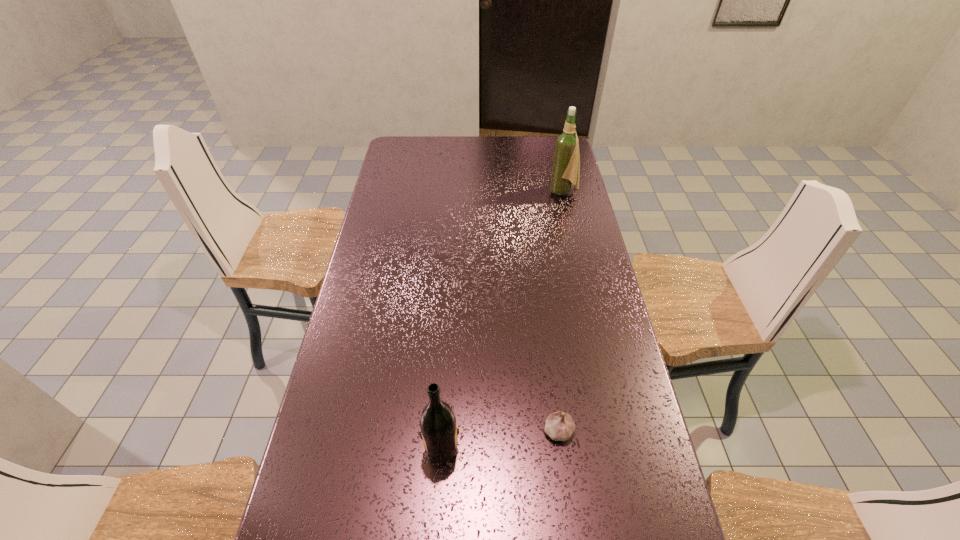
This screenshot has width=960, height=540. What are the coordinates of `the rightmost object` in the screenshot? It's located at (566, 165).

I want to click on the farther wine bottle, so click(566, 165).

At what (x,y) coordinates should I click in order to perform the action: click on the shorter wine bottle. Please return your answer as a coordinate pair (x, y). Looking at the image, I should click on (438, 426).

The width and height of the screenshot is (960, 540). I want to click on the second shortest object, so click(x=438, y=426).

Image resolution: width=960 pixels, height=540 pixels. I want to click on garlic, so click(x=559, y=426).

Where is `the shortest object`? Image resolution: width=960 pixels, height=540 pixels. the shortest object is located at coordinates (559, 426).

You are a GUI agent. You are given a task and a screenshot of the screen. Output one action in this format:
    pyautogui.click(x=<x>, y=<y>)
    Task: Click on the blank space located on the front-facing side of the farther wine bottle
    The image size is (960, 540).
    Given the screenshot: What is the action you would take?
    pyautogui.click(x=501, y=192)

In order to click on free region located 0.370m on the front-facing side of the farther wine bottle in this screenshot , I will do `click(459, 192)`.

Where is `vacant region located on the front-facing side of the farther wine bottle`? The width and height of the screenshot is (960, 540). vacant region located on the front-facing side of the farther wine bottle is located at coordinates (517, 192).

The image size is (960, 540). I want to click on vacant space located on the left of the shorter wine bottle, so click(x=324, y=445).